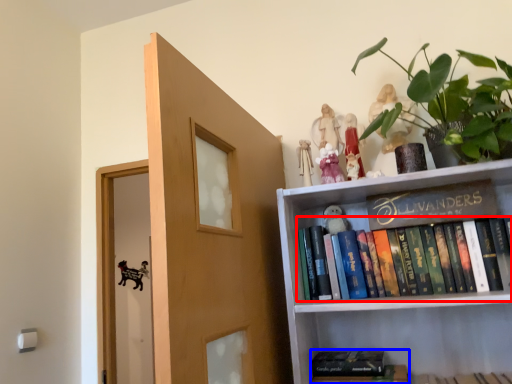
Question: Which object is further to the camera taking this photo, book (highlighted by a red box) or book (highlighted by a blue box)?

Choices:
 (A) book
 (B) book

Answer: (B)